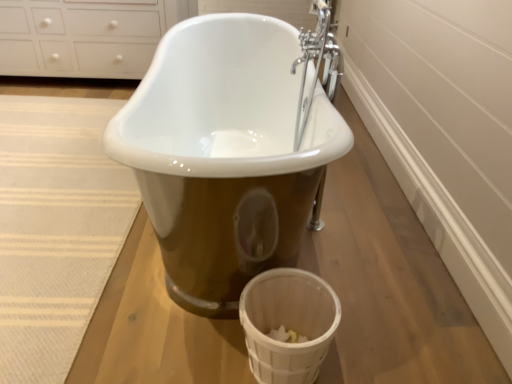
Question: Considering the positions of white glossy cabinet at upper left and white woven basket at lower right in the image, is white glossy cabinet at upper left taller or shorter than white woven basket at lower right?

Choices:
 (A) short
 (B) tall

Answer: (B)

Question: Considering their positions, is white glossy cabinet at upper left located in front of or behind white woven basket at lower right?

Choices:
 (A) behind
 (B) front

Answer: (A)

Question: Considering the real-world distances, which object is closest to the white glossy cabinet at upper left?

Choices:
 (A) white woven basket at lower right
 (B) beige woven rug at lower left

Answer: (B)

Question: Estimate the real-world distances between objects in this image. Which object is closer to the beige woven rug at lower left?

Choices:
 (A) white glossy cabinet at upper left
 (B) white woven basket at lower right

Answer: (B)